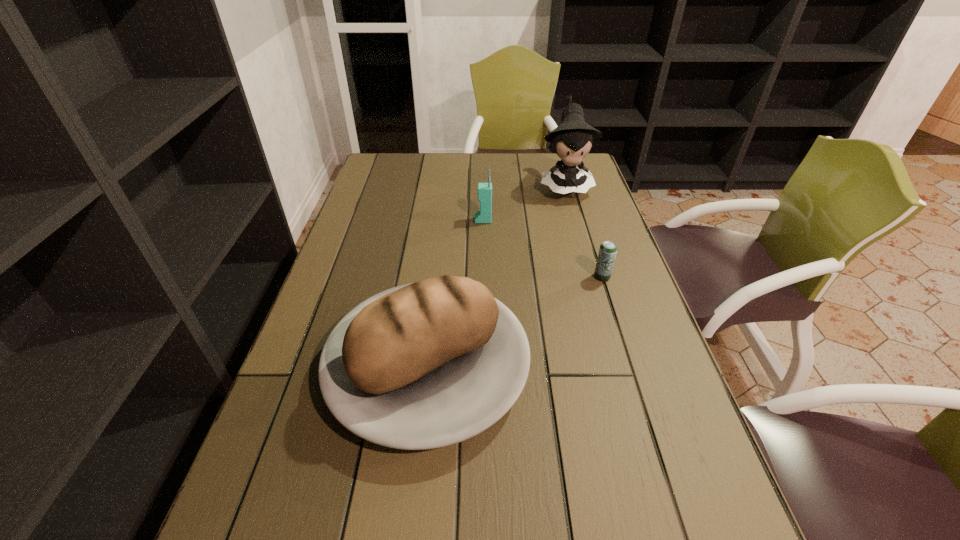
You are a GUI agent. You are given a task and a screenshot of the screen. Output one action in this format:
    pyautogui.click(x=<x>, y=<y>)
    Task: Click on the vacant space at the far left corner
    The height and width of the screenshot is (540, 960).
    Given the screenshot: What is the action you would take?
    pyautogui.click(x=397, y=179)

The height and width of the screenshot is (540, 960). I want to click on unoccupied position between the bread and the farthest object, so click(x=496, y=277).

Where is `free space between the beer can and the doll`? free space between the beer can and the doll is located at coordinates (584, 231).

At what (x,y) coordinates should I click in order to perform the action: click on free space between the nearest object and the farthest object. Please return your answer as a coordinate pair (x, y). The height and width of the screenshot is (540, 960). Looking at the image, I should click on (496, 277).

Locate an element on the screen. unoccupied position between the farthest object and the cellular telephone is located at coordinates (524, 203).

The height and width of the screenshot is (540, 960). Find the location of `empty space between the third farthest object and the doll`. empty space between the third farthest object and the doll is located at coordinates [x=584, y=231].

Identify the location of free space between the farthest object and the beer can. (584, 231).

The height and width of the screenshot is (540, 960). What are the coordinates of `vacant point located between the tallest object and the second nearest object` in the screenshot? It's located at [x=584, y=231].

Identify the location of the third closest object to the third nearest object. Image resolution: width=960 pixels, height=540 pixels. (607, 253).

Choose which object is the third nearest neighbor to the second nearest object. Please provide its 2D coordinates. Your answer should be formatted as a tuple, i.e. [(x, y)], where the tuple contains the x and y coordinates of a point satisfying the conditions above.

[(484, 214)]